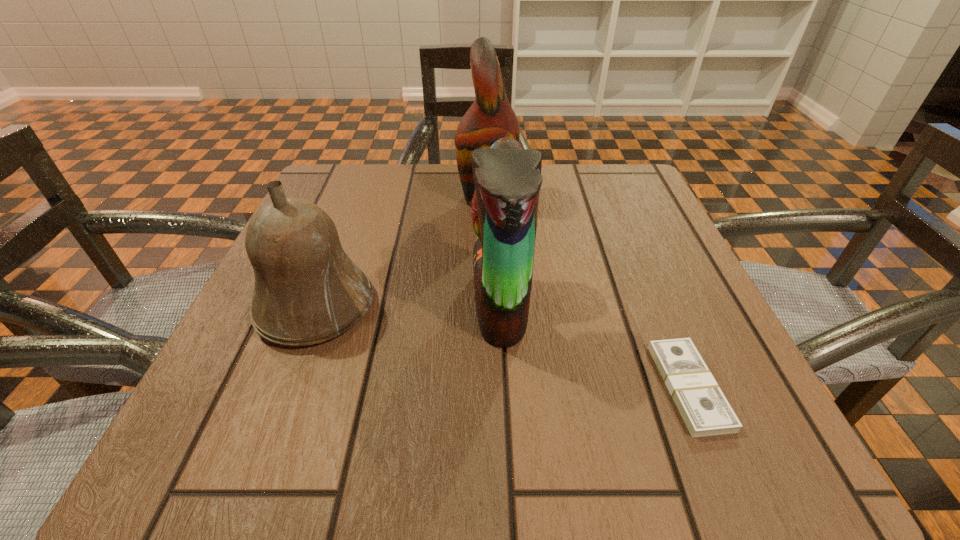
Find the location of a particular element. The image size is (960, 540). vacant area at the far edge is located at coordinates (411, 210).

Identify the location of free spot at the near edge of the desktop. The height and width of the screenshot is (540, 960). (376, 457).

Image resolution: width=960 pixels, height=540 pixels. I want to click on blank space at the left edge of the desktop, so click(x=226, y=401).

The height and width of the screenshot is (540, 960). In the image, there is a desktop. In order to click on vacant area at the right edge in this screenshot , I will do `click(612, 266)`.

I want to click on vacant space at the far left corner of the desktop, so click(x=362, y=206).

Locate an element on the screen. Image resolution: width=960 pixels, height=540 pixels. vacant space at the far right corner is located at coordinates (641, 219).

In order to click on free space at the near right corner in this screenshot , I will do `click(685, 471)`.

The image size is (960, 540). I want to click on empty space that is in between the bell and the second tallest object, so click(x=408, y=305).

At what (x,y) coordinates should I click in order to perform the action: click on unoccupied area between the shortest object and the farthest object. Please return your answer as a coordinate pair (x, y). Image resolution: width=960 pixels, height=540 pixels. Looking at the image, I should click on (589, 292).

What are the coordinates of `unoccupied area between the shortest object and the farthest object` in the screenshot? It's located at (589, 292).